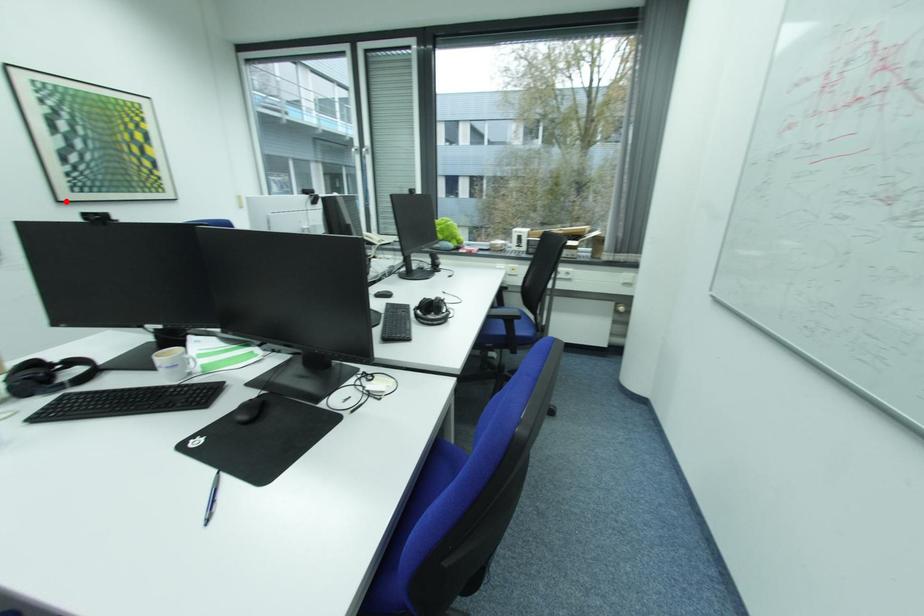
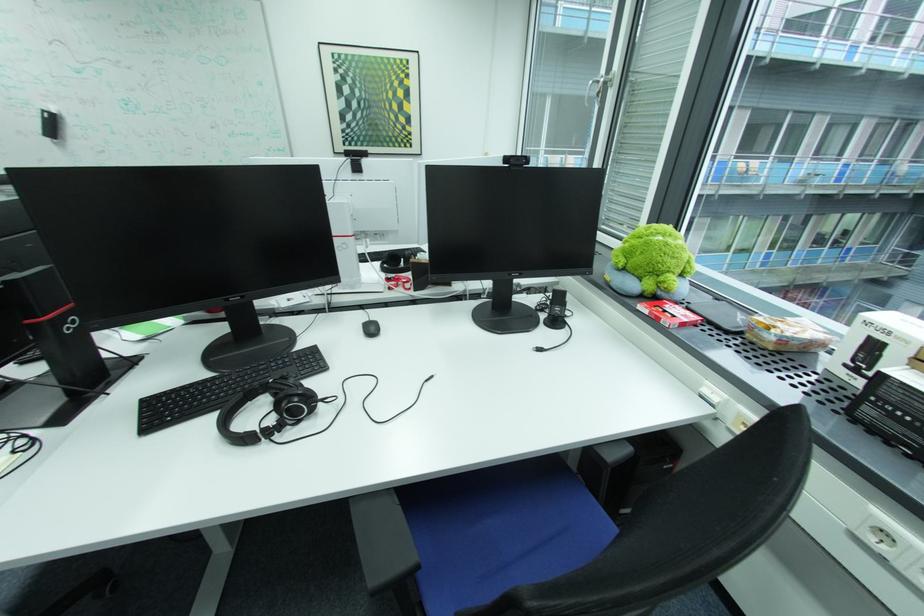
In the second image, find the point that corresponds to the highlighted location in the first image.

(344, 153)